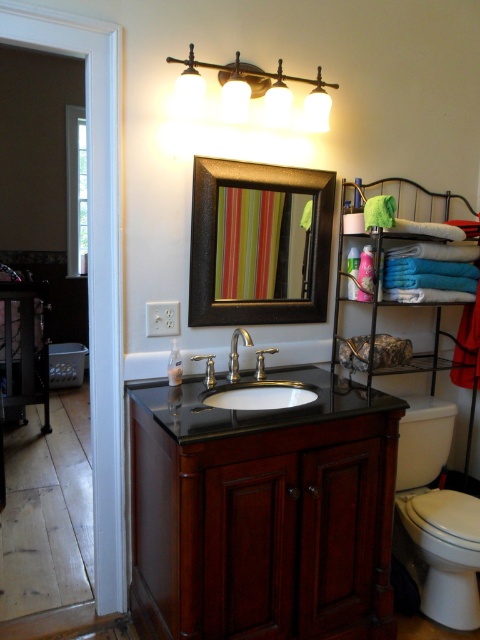
You are a plumber who needs to install a new faucet. The current polished chrome faucet at center is too close to the dark wood vanity at center. What is the minimum distance you need to move the faucet away from the vanity to meet the plumbing code requirement of 24 inches?

The dark wood vanity at center and polished chrome faucet at center are currently 20.04 inches apart. To meet the 24 inch requirement, the faucet needs to be moved 3.96 inches away from the vanity.

You are a plumber inspecting the bathroom setup. You need to locate the black polished granite sink at center and the polished chrome faucet at center. According to the scene, which object is positioned to the right of the other?

The black polished granite sink at center is to the right of the polished chrome faucet at center.

You are designing a bathroom layout and need to place a new decorative item between the dark wood vanity at center and the polished chrome faucet at center. Considering their sizes, which object should you place closer to the wall to ensure there is enough space?

The dark wood vanity at center is wider than the polished chrome faucet at center. To ensure enough space, place the polished chrome faucet at center closer to the wall since it is narrower.